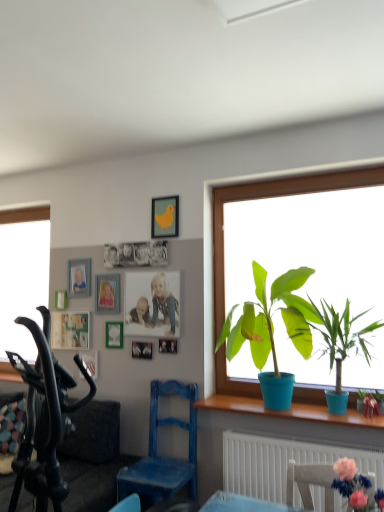
Question: From the image's perspective, is blue wooden picture frame at upper center, marked as the third picture frame in a left-to-right arrangement, positioned above or below matte white picture frame at upper left, the 8th picture frame viewed from the right?

Choices:
 (A) above
 (B) below

Answer: (A)

Question: Based on their sizes in the image, would you say blue wooden picture frame at upper center, marked as the third picture frame in a left-to-right arrangement, is bigger or smaller than matte white picture frame at upper left, which appears as the 1th picture frame when viewed from the left?

Choices:
 (A) big
 (B) small

Answer: (A)

Question: Considering the real-world distances, which object is farthest from the white fabric chair at lower right, the second chair from the back?

Choices:
 (A) dark gray fabric couch at lower left
 (B) metallic silver photo frame at upper center, acting as the first picture frame starting from the right
 (C) matte wooden picture frame at upper center, acting as the second picture frame starting from the left
 (D) green matte plant at right, positioned as the third houseplant in left-to-right order
 (E) blue wooden picture frame at upper center, arranged as the sixth picture frame when viewed from the right

Answer: (C)

Question: Considering the real-world distances, which object is farthest from the green matte plant at window, the 3th houseplant in the right-to-left sequence?

Choices:
 (A) matte yellow bird at upper center, which appears as the second picture frame when viewed from the right
 (B) white fabric chair at lower right, which is counted as the 1th chair, starting from the right
 (C) dark gray fabric couch at lower left
 (D) matte wooden picture frame at upper center, positioned as the 3th picture frame in right-to-left order
 (E) metallic silver photo frame at upper center, acting as the first picture frame starting from the right

Answer: (C)